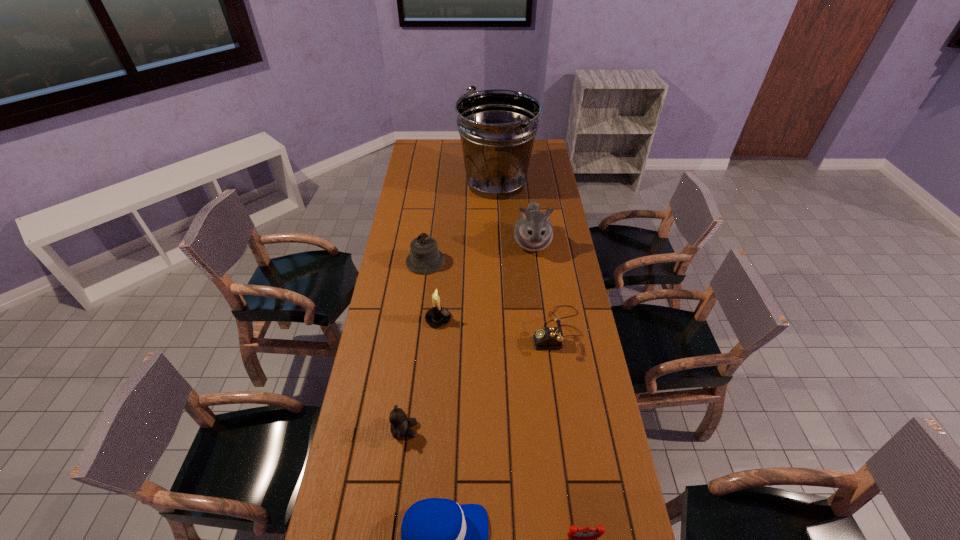
This screenshot has height=540, width=960. What are the coordinates of `free space located 0.190m on the front of the candle holder` in the screenshot? It's located at (433, 374).

Where is `vacant area situated on the face of the third nearest object`? vacant area situated on the face of the third nearest object is located at coordinates (467, 430).

Where is `blank space located 0.340m on the dial of the telephone`? This screenshot has height=540, width=960. blank space located 0.340m on the dial of the telephone is located at coordinates (439, 329).

Locate an element on the screen. vacant space situated 0.360m on the dial of the telephone is located at coordinates (433, 329).

Image resolution: width=960 pixels, height=540 pixels. What are the coordinates of `free spot located 0.400m on the dial of the telephone` in the screenshot? It's located at (421, 329).

Find the location of a particular element. This screenshot has width=960, height=540. bell at the left edge is located at coordinates (425, 258).

At what (x,y) coordinates should I click in order to perform the action: click on teddy bear located at the left edge. Please return your answer as a coordinate pair (x, y). This screenshot has height=540, width=960. Looking at the image, I should click on (400, 425).

This screenshot has height=540, width=960. Identify the location of bucket that is at the right edge. (497, 127).

Identify the location of hamster present at the right edge. (533, 231).

Find the location of a particular element. telephone positioned at the right edge is located at coordinates (551, 337).